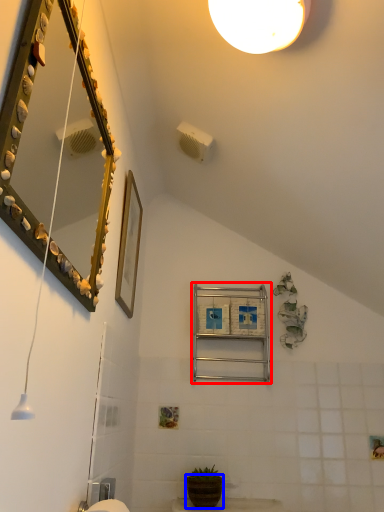
Question: Among these objects, which one is farthest to the camera, ladder (highlighted by a red box) or flowerpot (highlighted by a blue box)?

Choices:
 (A) ladder
 (B) flowerpot

Answer: (A)